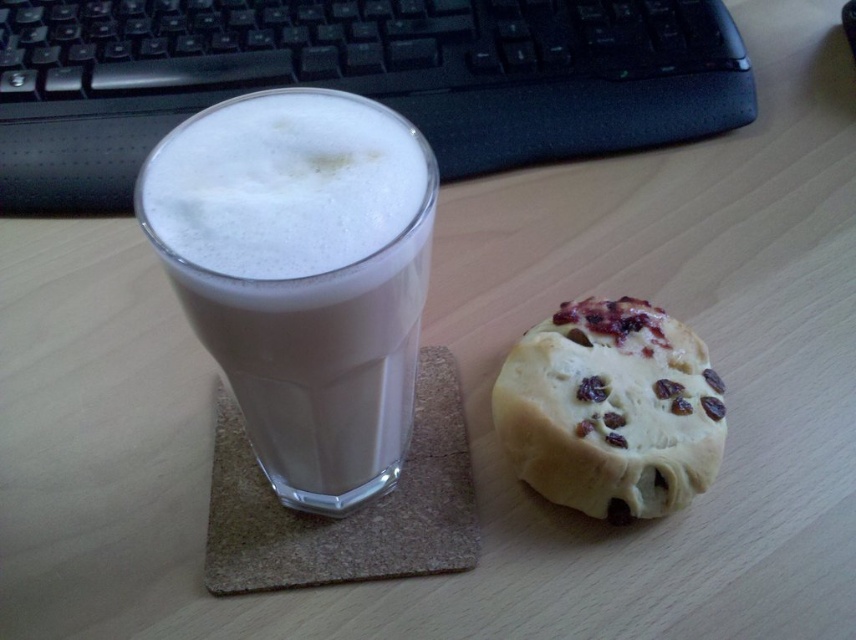
Question: Which point is closer to the camera?

Choices:
 (A) white frothy beverage at left
 (B) black plastic keyboard at upper center
 (C) golden crumbly biscuit at right

Answer: (A)

Question: Which point is closer to the camera taking this photo?

Choices:
 (A) (195, 260)
 (B) (603, 508)
 (C) (165, 6)

Answer: (A)

Question: Can you confirm if white frothy beverage at left is positioned to the right of golden crumbly biscuit at right?

Choices:
 (A) yes
 (B) no

Answer: (B)

Question: In this image, where is black plastic keyboard at upper center located relative to golden crumbly biscuit at right?

Choices:
 (A) below
 (B) above

Answer: (B)

Question: Which object is closer to the camera taking this photo?

Choices:
 (A) golden crumbly biscuit at right
 (B) black plastic keyboard at upper center

Answer: (A)

Question: Is black plastic keyboard at upper center wider than golden crumbly biscuit at right?

Choices:
 (A) yes
 (B) no

Answer: (A)